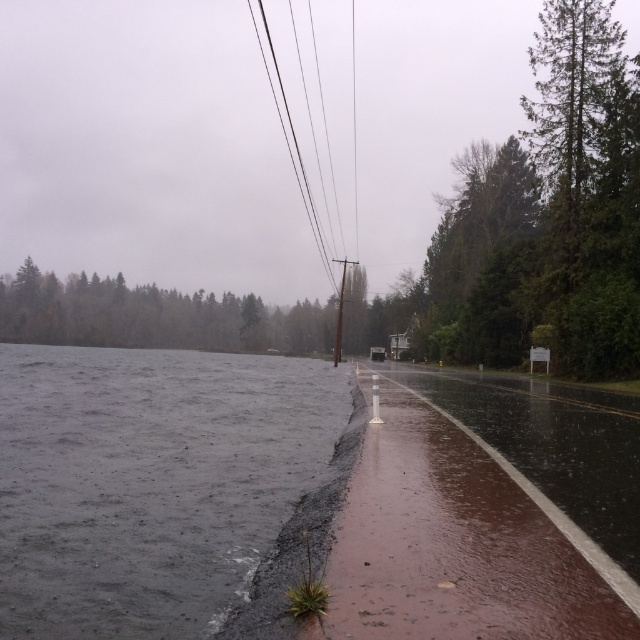
Is point (83, 538) positioned before point (314, 227)?

Yes, point (83, 538) is in front of point (314, 227).

Can you confirm if gray/rough water at lower left is thinner than black wire at upper center?

In fact, gray/rough water at lower left might be wider than black wire at upper center.

At what (x,y) coordinates should I click in order to perform the action: click on gray/rough water at lower left. Please return your answer as a coordinate pair (x, y). The width and height of the screenshot is (640, 640). Looking at the image, I should click on (148, 483).